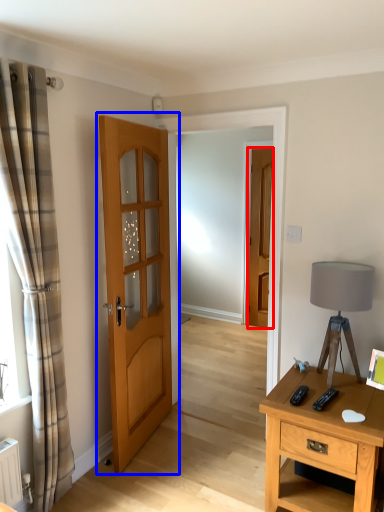
Question: Among these objects, which one is nearest to the camera, door (highlighted by a red box) or door (highlighted by a blue box)?

Choices:
 (A) door
 (B) door

Answer: (B)